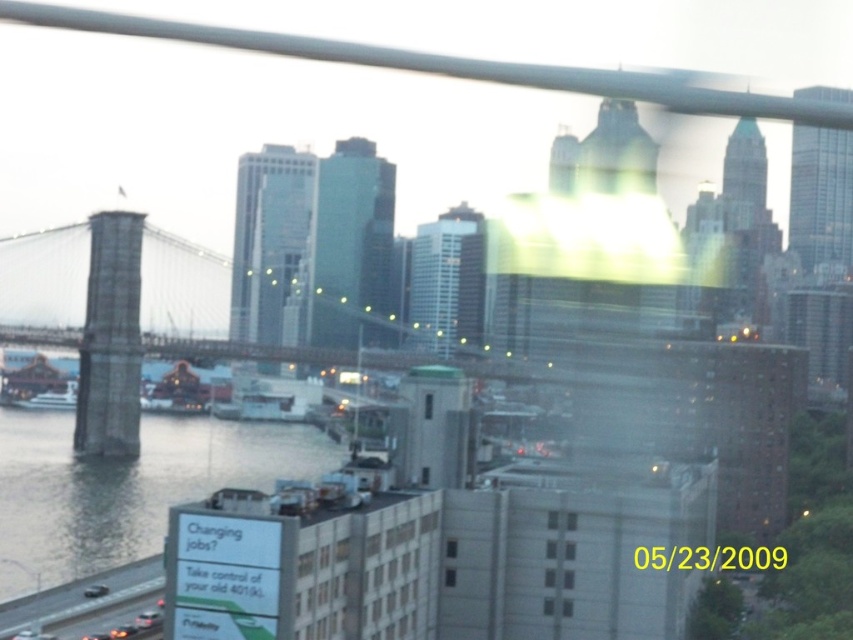
How distant is clear water at lower left from concrete bridge at center?

clear water at lower left and concrete bridge at center are 36.27 meters apart from each other.

Can you confirm if clear water at lower left is positioned below concrete bridge at center?

Correct, clear water at lower left is located below concrete bridge at center.

This screenshot has width=853, height=640. I want to click on clear water at lower left, so click(126, 486).

Image resolution: width=853 pixels, height=640 pixels. In order to click on clear water at lower left in this screenshot , I will do `click(126, 486)`.

Can you confirm if concrete bridge at center is wider than wooden ship at center?

Yes, concrete bridge at center is wider than wooden ship at center.

Between concrete bridge at center and wooden ship at center, which one has less height?

wooden ship at center

Is point (207, 332) farther from viewer compared to point (194, 381)?

Yes.

At what (x,y) coordinates should I click in order to perform the action: click on concrete bridge at center. Please return your answer as a coordinate pair (x, y). Looking at the image, I should click on (201, 308).

Can you confirm if wooden ship at center is positioned above white matte boat at left?

Yes.

Which is above, wooden ship at center or white matte boat at left?

wooden ship at center is higher up.

The image size is (853, 640). Identify the location of wooden ship at center. (177, 392).

The height and width of the screenshot is (640, 853). In order to click on wooden ship at center in this screenshot , I will do `click(177, 392)`.